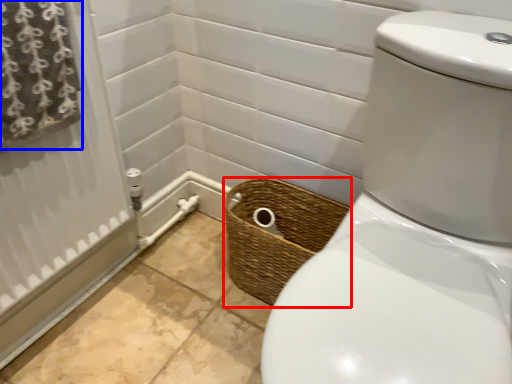
Question: Which object appears closest to the camera in this image, basket (highlighted by a red box) or curtain (highlighted by a blue box)?

Choices:
 (A) basket
 (B) curtain

Answer: (B)